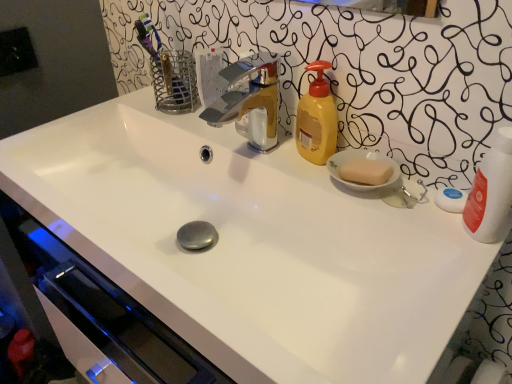
Identify the location of free space between polished chrome faucet at center and yellow matte soap dispenser at upper right. The image size is (512, 384). (279, 155).